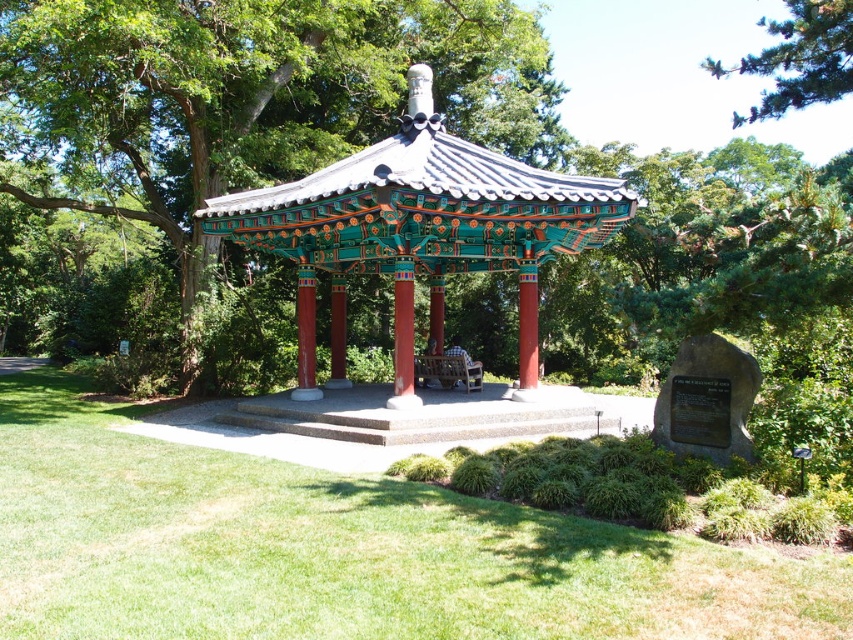
Is green grass at center taller than green pine tree at upper right?

No.

Is green grass at center closer to the viewer compared to green pine tree at upper right?

Yes, green grass at center is closer to the viewer.

The height and width of the screenshot is (640, 853). I want to click on green grass at center, so click(340, 548).

Which is more to the right, green pine tree at upper right or wooden bench at center?

green pine tree at upper right

Is green pine tree at upper right bigger than wooden bench at center?

Correct, green pine tree at upper right is larger in size than wooden bench at center.

This screenshot has width=853, height=640. What are the coordinates of `green pine tree at upper right` in the screenshot? It's located at (x=798, y=58).

Who is positioned more to the left, multicolored painted gazebo at center or wooden bench at center?

multicolored painted gazebo at center

Is point (207, 216) in front of point (447, 381)?

That is True.

This screenshot has width=853, height=640. Describe the element at coordinates (418, 230) in the screenshot. I see `multicolored painted gazebo at center` at that location.

Image resolution: width=853 pixels, height=640 pixels. In order to click on multicolored painted gazebo at center in this screenshot , I will do `click(418, 230)`.